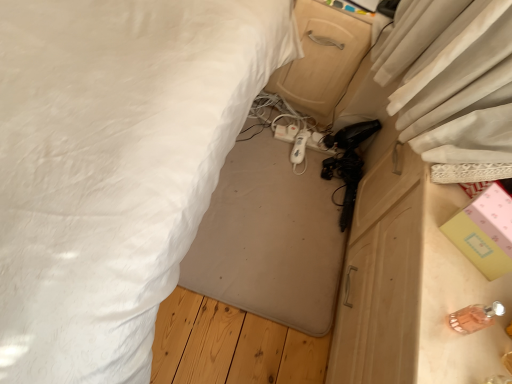
Identify the location of vacant space that is to the left of translucent glass perfume bottle at lower right, the 2th equipment positioned from the left. (422, 301).